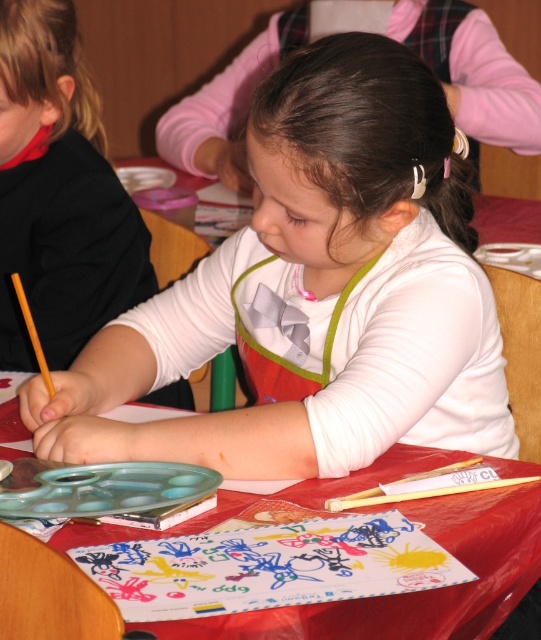
Can you confirm if matte white shirt at center is positioned to the right of red plastic table at center?

Incorrect, matte white shirt at center is not on the right side of red plastic table at center.

Is matte white shirt at center wider than red plastic table at center?

In fact, matte white shirt at center might be narrower than red plastic table at center.

Does point (9, 52) come in front of point (159, 536)?

That is False.

Where is `matte white shirt at center`? The height and width of the screenshot is (640, 541). matte white shirt at center is located at coordinates (58, 193).

Who is more distant from viewer, [372,51] or [249,627]?

Point [372,51]

Is white matte apron at center thinner than red plastic table at center?

No.

Does point (432, 344) come closer to viewer compared to point (478, 624)?

That is False.

You are a GUI agent. You are given a task and a screenshot of the screen. Output one action in this format:
    pyautogui.click(x=<x>, y=<y>)
    Task: Click on the white matte apron at center
    Image resolution: width=541 pixels, height=640 pixels.
    Given the screenshot: What is the action you would take?
    pyautogui.click(x=314, y=292)

Consider the image. Does white matte apron at center have a smaller size compared to matte white shirt at center?

No.

Image resolution: width=541 pixels, height=640 pixels. What are the coordinates of `white matte apron at center` in the screenshot? It's located at (314, 292).

Does point (379, 420) come in front of point (68, 129)?

That is True.

What are the coordinates of `white matte apron at center` in the screenshot? It's located at (314, 292).